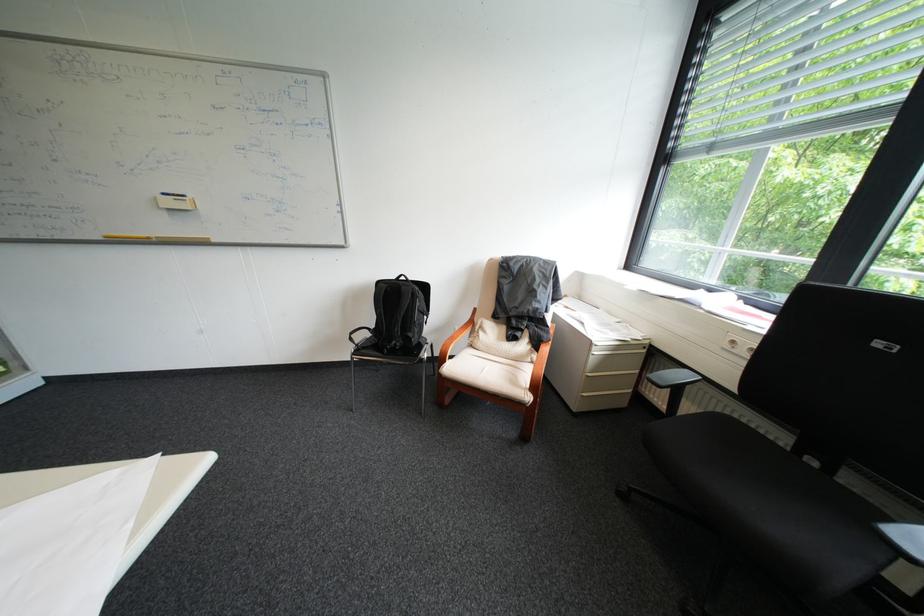
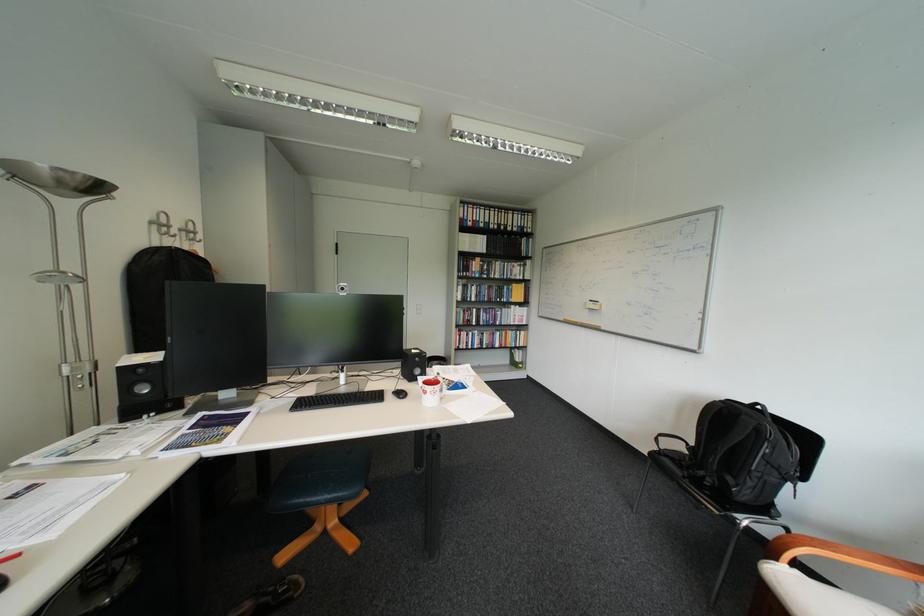
Locate, in the second image, the point that corresponds to (457,371) in the first image.

(783, 572)